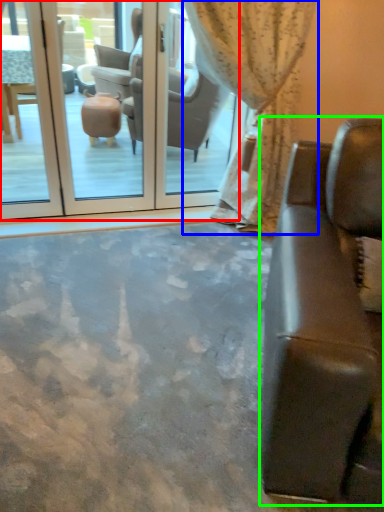
Question: Which object is the closest to the screen door (highlighted by a red box)? Choose among these: curtain (highlighted by a blue box) or studio couch (highlighted by a green box).

Choices:
 (A) curtain
 (B) studio couch

Answer: (A)